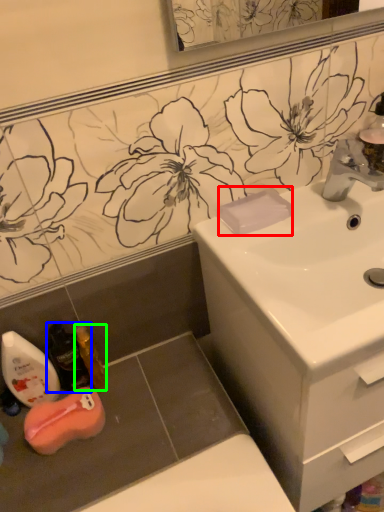
Question: Which object is positioned farthest from soap (highlighted by a red box)? Select from mouthwash (highlighted by a blue box) and mouthwash (highlighted by a green box).

Choices:
 (A) mouthwash
 (B) mouthwash

Answer: (A)